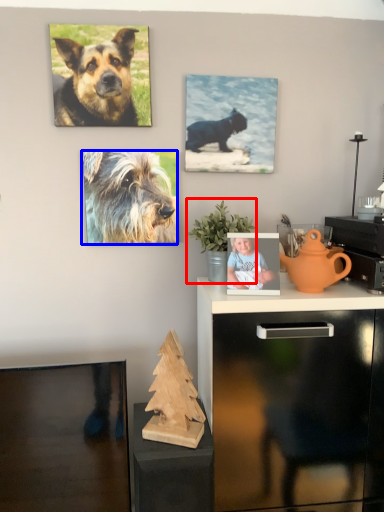
Question: Among these objects, which one is farthest to the camera, houseplant (highlighted by a red box) or dog (highlighted by a blue box)?

Choices:
 (A) houseplant
 (B) dog

Answer: (B)